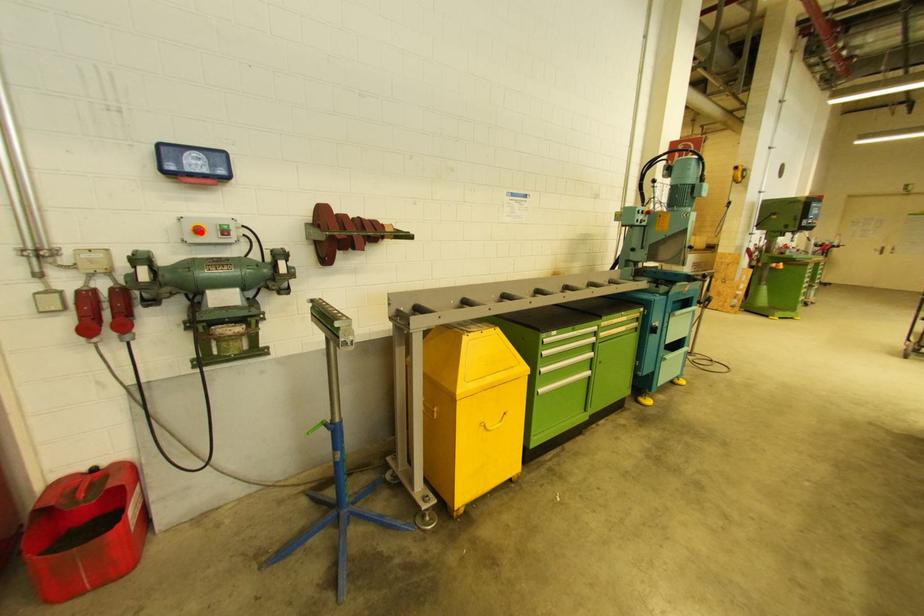
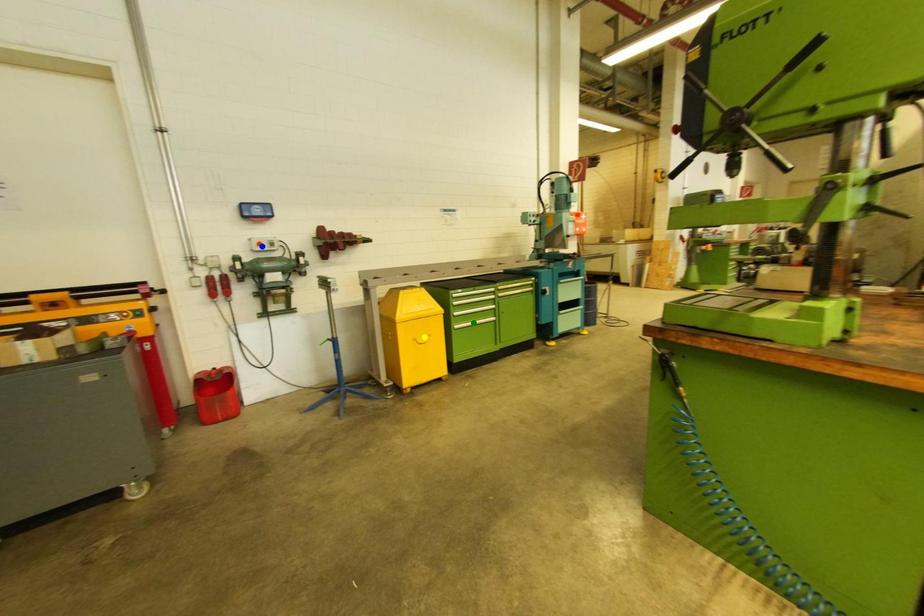
Question: I am providing you with two images of the same scene from different viewpoints. A red point is marked on the first image. You are given multiple points on the second image. Which spot in image 2 lines up with the point in image 1?

Choices:
 (A) yellow point
 (B) blue point
 (C) green point

Answer: (B)